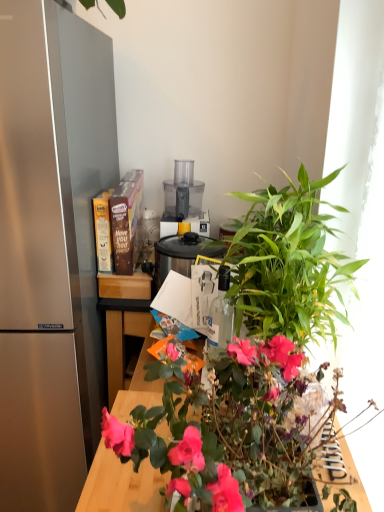
Question: From the image's perspective, does green leafy plant at center appear higher than black plastic slow cooker at center, which is counted as the 3th appliance, starting from the top?

Choices:
 (A) no
 (B) yes

Answer: (A)

Question: From a real-world perspective, is green leafy plant at center under black plastic slow cooker at center, the 1th appliance when ordered from bottom to top?

Choices:
 (A) yes
 (B) no

Answer: (B)

Question: Considering the relative sizes of green leafy plant at center and black plastic slow cooker at center, which is counted as the 3th appliance, starting from the top, in the image provided, is green leafy plant at center bigger than black plastic slow cooker at center, which is counted as the 3th appliance, starting from the top,?

Choices:
 (A) no
 (B) yes

Answer: (B)

Question: Is black plastic slow cooker at center, the 1th appliance when ordered from bottom to top, inside green leafy plant at center?

Choices:
 (A) yes
 (B) no

Answer: (B)

Question: Does green leafy plant at center appear on the right side of black plastic slow cooker at center, which is counted as the 3th appliance, starting from the top?

Choices:
 (A) yes
 (B) no

Answer: (A)

Question: Is green leafy plant at center oriented away from black plastic slow cooker at center, which is counted as the 3th appliance, starting from the top?

Choices:
 (A) no
 (B) yes

Answer: (A)

Question: Can you confirm if green leafy plant at center is positioned to the right of satin silver refrigerator at left?

Choices:
 (A) yes
 (B) no

Answer: (A)

Question: Does green leafy plant at center have a lesser width compared to satin silver refrigerator at left?

Choices:
 (A) yes
 (B) no

Answer: (A)

Question: Is green leafy plant at center completely or partially outside of satin silver refrigerator at left?

Choices:
 (A) no
 (B) yes

Answer: (B)

Question: Is the position of green leafy plant at center more distant than that of satin silver refrigerator at left?

Choices:
 (A) no
 (B) yes

Answer: (A)

Question: Is green leafy plant at center to the left of satin silver refrigerator at left from the viewer's perspective?

Choices:
 (A) no
 (B) yes

Answer: (A)

Question: Is green leafy plant at center with satin silver refrigerator at left?

Choices:
 (A) yes
 (B) no

Answer: (B)

Question: Can you confirm if black plastic slow cooker at center, the 1th appliance when ordered from bottom to top, is shorter than green leafy plant at center-right?

Choices:
 (A) yes
 (B) no

Answer: (A)